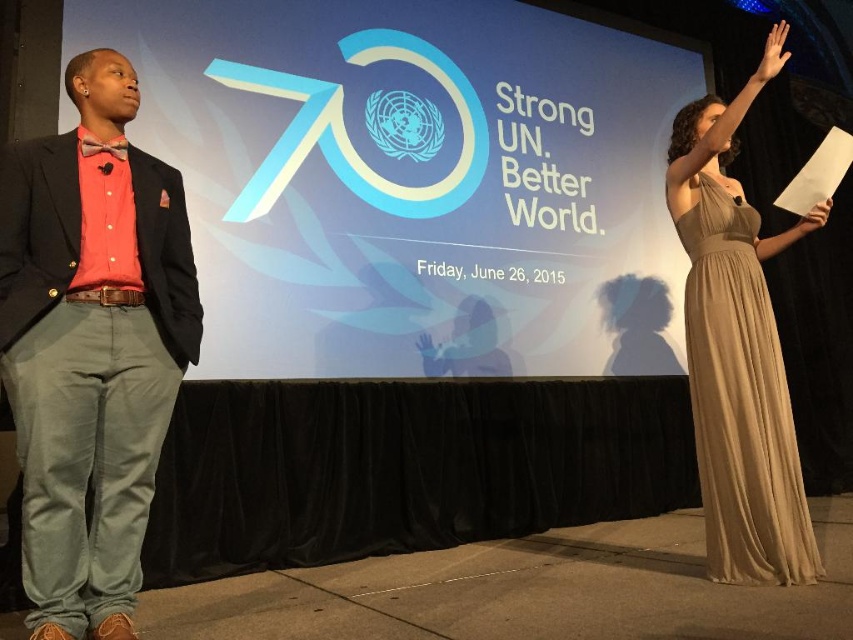
Question: Which object appears closest to the camera in this image?

Choices:
 (A) white paper at upper right
 (B) brushed cotton suit at left
 (C) satin beige dress at right
 (D) matte skin hand at upper right

Answer: (B)

Question: Does brushed cotton suit at left appear over white paper at upper right?

Choices:
 (A) no
 (B) yes

Answer: (A)

Question: Among these objects, which one is nearest to the camera?

Choices:
 (A) matte skin hand at upper right
 (B) brushed cotton suit at left

Answer: (B)

Question: Is brushed cotton suit at left to the left of matte skin hand at upper right from the viewer's perspective?

Choices:
 (A) no
 (B) yes

Answer: (B)

Question: Is brushed cotton suit at left further to camera compared to white paper at upper right?

Choices:
 (A) yes
 (B) no

Answer: (B)

Question: Which point is closer to the camera?

Choices:
 (A) (804, 220)
 (B) (785, 51)
 (C) (801, 579)
 (D) (73, 621)

Answer: (D)